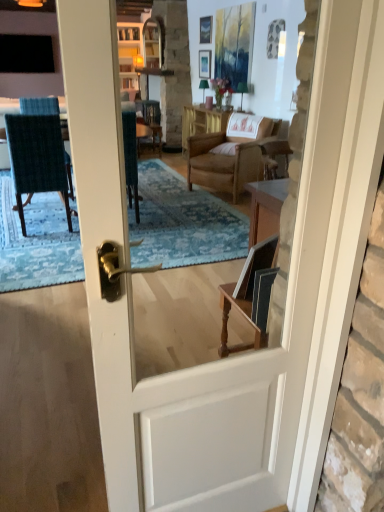
Question: Is dark blue textured fabric chair at left at the back of wooden table at center?

Choices:
 (A) no
 (B) yes

Answer: (A)

Question: Considering the relative sizes of wooden table at center and dark blue textured fabric chair at left in the image provided, is wooden table at center shorter than dark blue textured fabric chair at left?

Choices:
 (A) yes
 (B) no

Answer: (A)

Question: From a real-world perspective, is wooden table at center located beneath dark blue textured fabric chair at left?

Choices:
 (A) yes
 (B) no

Answer: (A)

Question: From the image's perspective, is wooden table at center below dark blue textured fabric chair at left?

Choices:
 (A) no
 (B) yes

Answer: (A)

Question: Can you confirm if wooden table at center is thinner than dark blue textured fabric chair at left?

Choices:
 (A) yes
 (B) no

Answer: (A)

Question: Choose the correct answer: Is wooden table at center inside black glass window at upper left or outside it?

Choices:
 (A) inside
 (B) outside

Answer: (B)

Question: In the image, is wooden table at center positioned in front of or behind black glass window at upper left?

Choices:
 (A) front
 (B) behind

Answer: (A)

Question: Visually, is wooden table at center positioned to the left or to the right of black glass window at upper left?

Choices:
 (A) left
 (B) right

Answer: (B)

Question: Considering the positions of wooden table at center and black glass window at upper left in the image, is wooden table at center wider or thinner than black glass window at upper left?

Choices:
 (A) wide
 (B) thin

Answer: (A)

Question: Looking at their shapes, would you say black glass window at upper left is wider or thinner than wooden picture frame at upper center, the first picture frame in the top-to-bottom sequence?

Choices:
 (A) thin
 (B) wide

Answer: (B)

Question: In the image, is black glass window at upper left positioned in front of or behind wooden picture frame at upper center, the first picture frame in the top-to-bottom sequence?

Choices:
 (A) behind
 (B) front

Answer: (A)

Question: From their relative heights in the image, would you say black glass window at upper left is taller or shorter than wooden picture frame at upper center, the first picture frame in the top-to-bottom sequence?

Choices:
 (A) tall
 (B) short

Answer: (A)

Question: From the image's perspective, relative to wooden picture frame at upper center, the 2th picture frame positioned from the bottom, is black glass window at upper left above or below?

Choices:
 (A) below
 (B) above

Answer: (B)

Question: Is black glass window at upper left inside or outside of matte white picture frame at upper center, the second picture frame in the top-to-bottom sequence?

Choices:
 (A) inside
 (B) outside

Answer: (B)

Question: Is black glass window at upper left taller or shorter than matte white picture frame at upper center, the second picture frame in the top-to-bottom sequence?

Choices:
 (A) short
 (B) tall

Answer: (B)